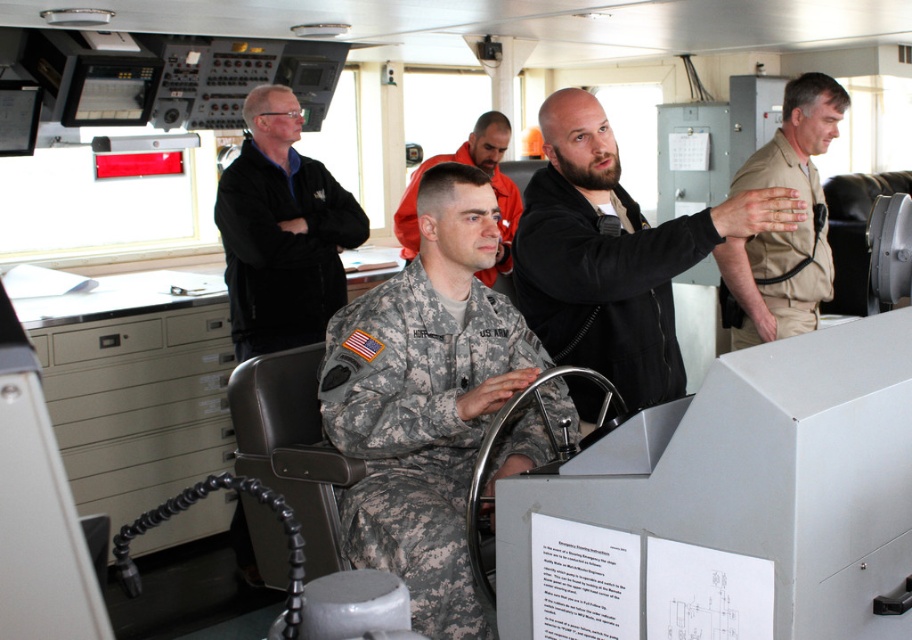
Question: Is black matte jacket at center thinner than camouflage uniform at center?

Choices:
 (A) yes
 (B) no

Answer: (A)

Question: Which point is closer to the camera?

Choices:
 (A) (302, 180)
 (B) (418, 620)

Answer: (B)

Question: Which of the following is the farthest from the observer?

Choices:
 (A) camouflage uniform at center
 (B) black matte jacket at center
 (C) camouflage fabric uniform at center

Answer: (A)

Question: Is the position of camouflage fabric uniform at center more distant than that of camouflage uniform at center?

Choices:
 (A) no
 (B) yes

Answer: (A)

Question: Among these points, which one is nearest to the camera?

Choices:
 (A) (800, 275)
 (B) (407, 323)
 (C) (491, 157)

Answer: (B)

Question: Is black matte jacket at center bigger than black fleece jacket at upper left?

Choices:
 (A) no
 (B) yes

Answer: (A)